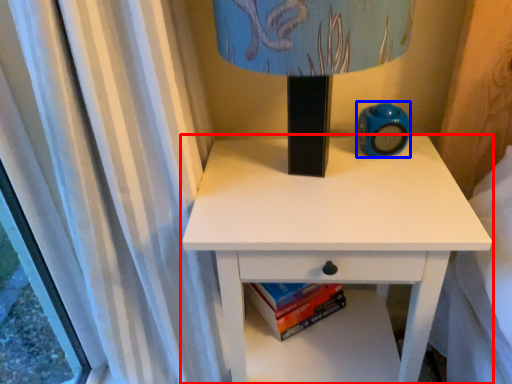
Question: Which object appears farthest to the camera in this image, nightstand (highlighted by a red box) or teal (highlighted by a blue box)?

Choices:
 (A) nightstand
 (B) teal

Answer: (B)